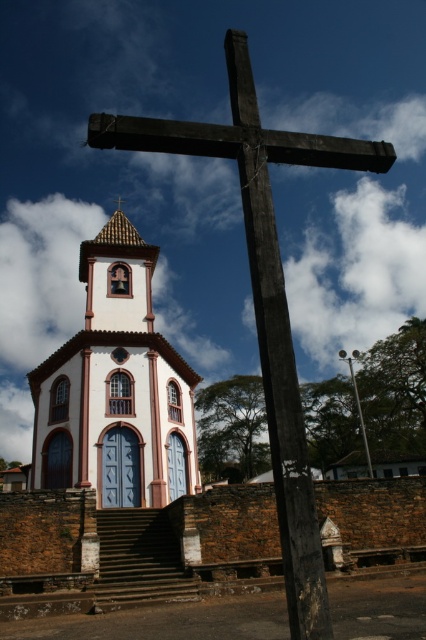
Question: Is dark wood cross at upper center wider than silver metallic pole at center?

Choices:
 (A) no
 (B) yes

Answer: (A)

Question: Which point is farther to the camera?

Choices:
 (A) dark wood cross at upper center
 (B) white matte church at center
 (C) silver metallic pole at center

Answer: (C)

Question: Can you confirm if white matte church at center is positioned to the right of dark wood cross at upper center?

Choices:
 (A) no
 (B) yes

Answer: (A)

Question: Is white matte church at center thinner than silver metallic pole at center?

Choices:
 (A) no
 (B) yes

Answer: (B)

Question: Among these objects, which one is farthest from the camera?

Choices:
 (A) silver metallic pole at center
 (B) dark wood cross at upper center
 (C) white matte church at center

Answer: (A)

Question: Which point is farther from the camera taking this photo?

Choices:
 (A) (362, 442)
 (B) (304, 440)
 (C) (92, 336)

Answer: (A)